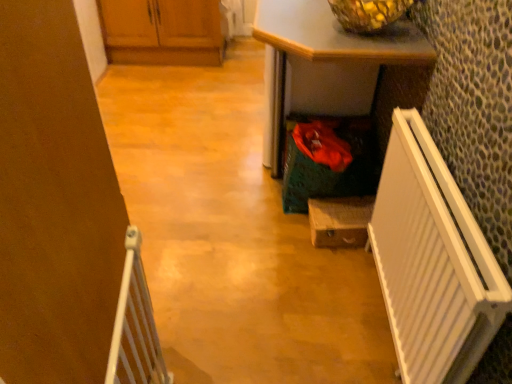
Locate an element on the screen. The height and width of the screenshot is (384, 512). vacant area that lies in front of wooden drawer at center, acting as the 1th cabinetry starting from the front is located at coordinates (337, 269).